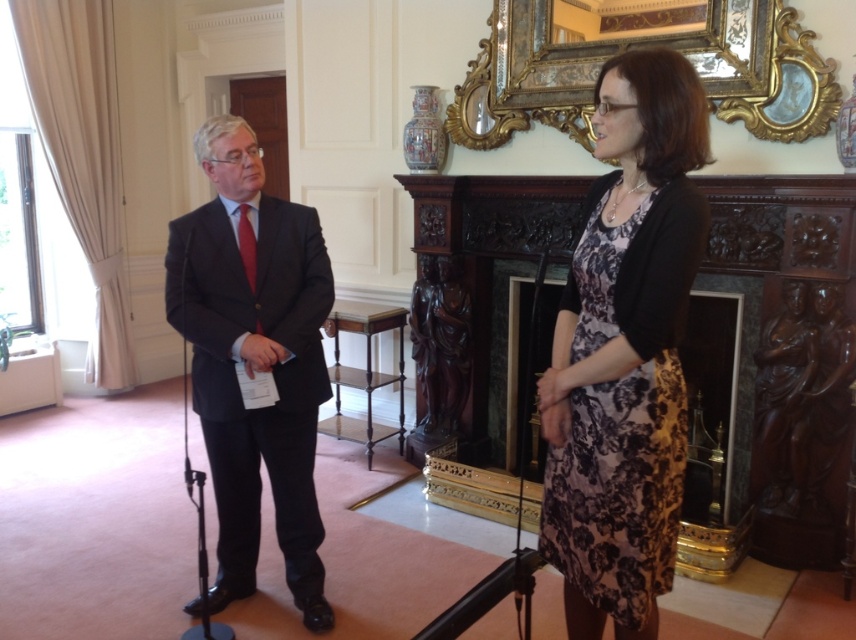
Question: In this image, where is dark gray suit at left located relative to gold ornate picture frame at upper center?

Choices:
 (A) left
 (B) right

Answer: (A)

Question: Which object is positioned farthest from the gold ornate picture frame at upper center?

Choices:
 (A) floral-patterned fabric dress at center
 (B) dark gray suit at left

Answer: (B)

Question: Estimate the real-world distances between objects in this image. Which object is farther from the gold ornate picture frame at upper center?

Choices:
 (A) dark gray suit at left
 (B) floral-patterned fabric dress at center

Answer: (A)

Question: Can you confirm if dark gray suit at left is positioned below gold ornate picture frame at upper center?

Choices:
 (A) no
 (B) yes

Answer: (B)

Question: Among these objects, which one is farthest from the camera?

Choices:
 (A) gold ornate picture frame at upper center
 (B) dark gray suit at left
 (C) floral-patterned fabric dress at center

Answer: (A)

Question: Is floral-patterned fabric dress at center above dark gray suit at left?

Choices:
 (A) no
 (B) yes

Answer: (A)